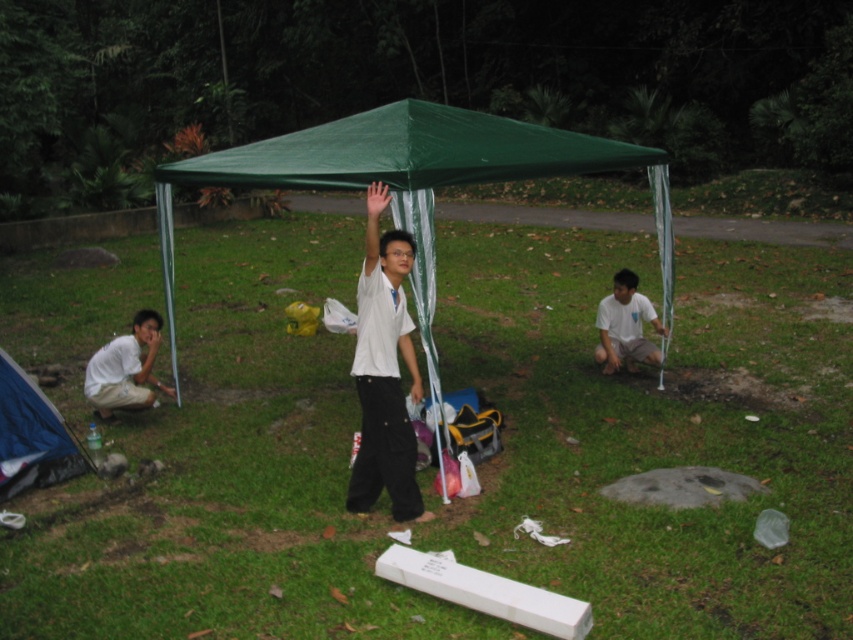
Question: Is green grass at center smaller than white matte shirt at center?

Choices:
 (A) yes
 (B) no

Answer: (B)

Question: Is white matte shirt at center to the left of white matte shirt at lower left from the viewer's perspective?

Choices:
 (A) no
 (B) yes

Answer: (A)

Question: Based on their relative distances, which object is farther from the green grass at center?

Choices:
 (A) white matte shirt at lower left
 (B) blue fabric tent at lower left
 (C) white cotton shirt at lower right

Answer: (A)

Question: Which point is closer to the camera?

Choices:
 (A) (660, 360)
 (B) (407, 192)
 (C) (10, 372)
 (D) (807, 269)

Answer: (B)

Question: Which object appears closest to the camera in this image?

Choices:
 (A) green fabric tent at center
 (B) white matte shirt at lower left
 (C) green grass at center

Answer: (C)

Question: Is green fabric tent at center to the left of white cotton shirt at lower right from the viewer's perspective?

Choices:
 (A) yes
 (B) no

Answer: (A)